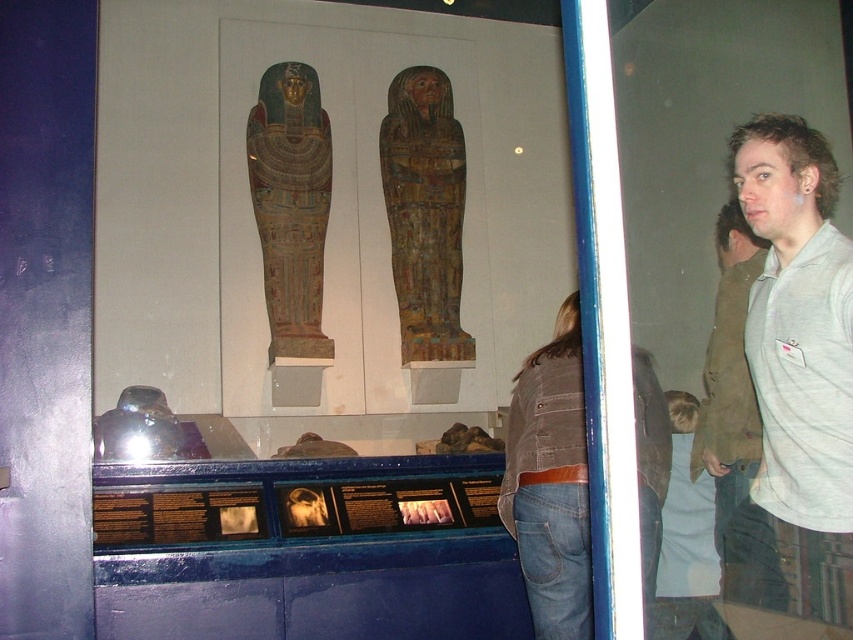
From the picture: How distant is wooden painted sarcophagus at center from brown denim jacket at lower right?

The distance of wooden painted sarcophagus at center from brown denim jacket at lower right is 4.84 feet.

What do you see at coordinates (425, 212) in the screenshot?
I see `wooden painted sarcophagus at center` at bounding box center [425, 212].

Between point (462, 349) and point (653, 435), which one is positioned in front?

Point (653, 435) is more forward.

Locate an element on the screen. The image size is (853, 640). wooden painted sarcophagus at center is located at coordinates (425, 212).

From the picture: Which is more to the right, brown denim jacket at lower right or gray cotton sweatshirt at right?

gray cotton sweatshirt at right is more to the right.

The image size is (853, 640). In order to click on brown denim jacket at lower right in this screenshot , I will do `click(543, 429)`.

The image size is (853, 640). Describe the element at coordinates (543, 429) in the screenshot. I see `brown denim jacket at lower right` at that location.

This screenshot has height=640, width=853. What are the coordinates of `brown denim jacket at lower right` in the screenshot? It's located at point(543,429).

The height and width of the screenshot is (640, 853). What do you see at coordinates (291, 205) in the screenshot?
I see `polychrome painted sarcophagus at center` at bounding box center [291, 205].

Is polychrome painted sarcophagus at center bigger than brown denim jacket at lower right?

Indeed, polychrome painted sarcophagus at center has a larger size compared to brown denim jacket at lower right.

Where is `polychrome painted sarcophagus at center`? The width and height of the screenshot is (853, 640). polychrome painted sarcophagus at center is located at coordinates pos(291,205).

Identify the location of polychrome painted sarcophagus at center. This screenshot has width=853, height=640. (291, 205).